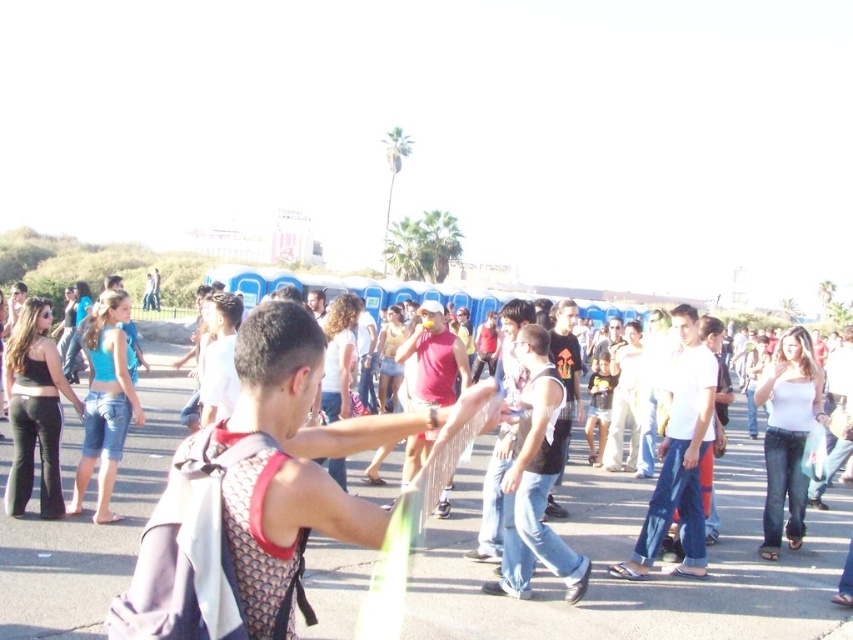
You are organizing a clothing display and need to arrange the mesh fabric tank top at center and the white cotton shirt at center side by side. Which of the two clothing items should be placed on the left to ensure they fit within a 1.5 meter wide display stand?

The mesh fabric tank top at center is wider than the white cotton shirt at center, so placing the white cotton shirt at center on the left and the mesh fabric tank top at center on the right would allow both items to fit within the 1.5 meter display stand.

You are standing in the middle of a crowd and see two people wearing dark gray tank top at center and white cotton shirt at center. Which one is more to the left?

The dark gray tank top at center is more to the left side of the white cotton shirt at center.